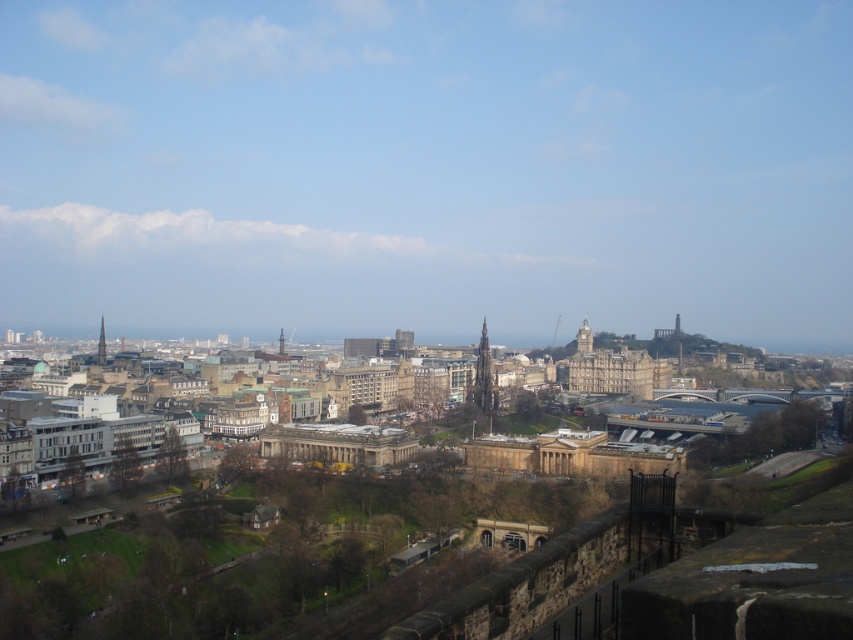
Can you confirm if smooth gray stone tower at center is taller than smooth stone tower at center?

Yes.

Does smooth gray stone tower at center appear over smooth stone tower at center?

No, smooth gray stone tower at center is not above smooth stone tower at center.

What do you see at coordinates (485, 376) in the screenshot? This screenshot has height=640, width=853. I see `smooth gray stone tower at center` at bounding box center [485, 376].

This screenshot has height=640, width=853. What are the coordinates of `smooth gray stone tower at center` in the screenshot? It's located at (485, 376).

Who is taller, smooth gray stone tower at center or smooth stone clock tower at center?

smooth gray stone tower at center

Who is lower down, smooth gray stone tower at center or smooth stone clock tower at center?

smooth gray stone tower at center

Find the location of a particular element. This screenshot has height=640, width=853. smooth gray stone tower at center is located at coordinates (485, 376).

Can you confirm if smooth stone clock tower at center is bigger than smooth stone tower at center?

Incorrect, smooth stone clock tower at center is not larger than smooth stone tower at center.

Can you confirm if smooth stone clock tower at center is positioned above smooth stone tower at center?

Incorrect, smooth stone clock tower at center is not positioned above smooth stone tower at center.

Is point (579, 340) less distant than point (103, 339)?

That is False.

The width and height of the screenshot is (853, 640). Identify the location of smooth stone clock tower at center. point(584,339).